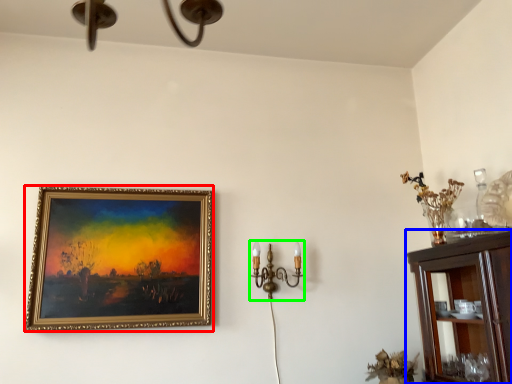
Question: Based on their relative distances, which object is nearer to picture frame (highlighted by a red box)? Choose from cabinetry (highlighted by a blue box) and candle holder (highlighted by a green box).

Choices:
 (A) cabinetry
 (B) candle holder

Answer: (B)